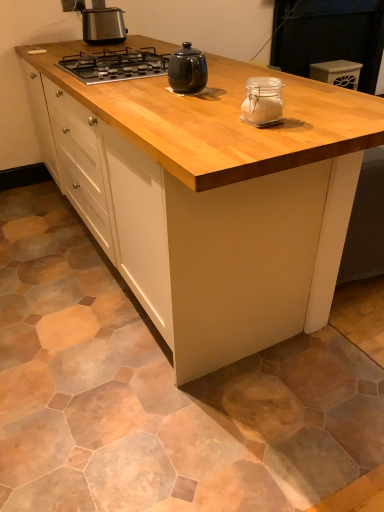
Identify the location of free space that is to the left of clear glass jar at center, marked as the 1th kitchen appliance in a bottom-to-top arrangement. click(208, 122).